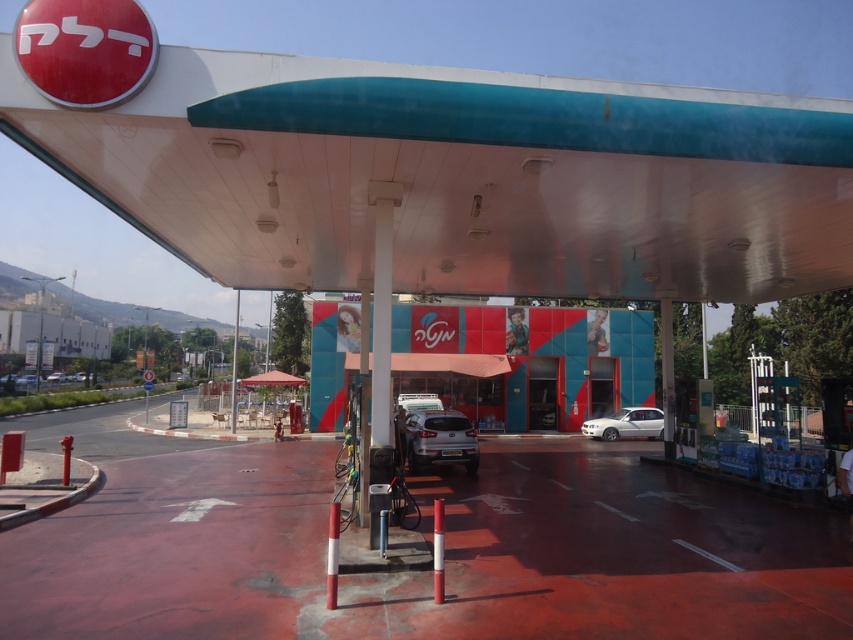
Is white metallic car at center shorter than satin silver sedan at center?

No, white metallic car at center is not shorter than satin silver sedan at center.

Can you confirm if white metallic car at center is positioned to the right of satin silver sedan at center?

Indeed, white metallic car at center is positioned on the right side of satin silver sedan at center.

Describe the element at coordinates (625, 422) in the screenshot. I see `white metallic car at center` at that location.

Where is `white metallic car at center`? This screenshot has height=640, width=853. white metallic car at center is located at coordinates (625, 422).

Between point (474, 460) and point (608, 436), which one is positioned behind?

Positioned behind is point (608, 436).

Which is in front, point (453, 429) or point (619, 429)?

Point (453, 429) is more forward.

This screenshot has height=640, width=853. Identify the location of satin silver suv at center. (440, 440).

Does matte plastic gas station at center appear on the left side of satin silver suv at center?

In fact, matte plastic gas station at center is to the right of satin silver suv at center.

Does matte plastic gas station at center have a smaller size compared to satin silver suv at center?

No, matte plastic gas station at center is not smaller than satin silver suv at center.

Between point (432, 326) and point (444, 417), which one is positioned behind?

The point (432, 326) is behind.

Identify the location of matte plastic gas station at center. (524, 362).